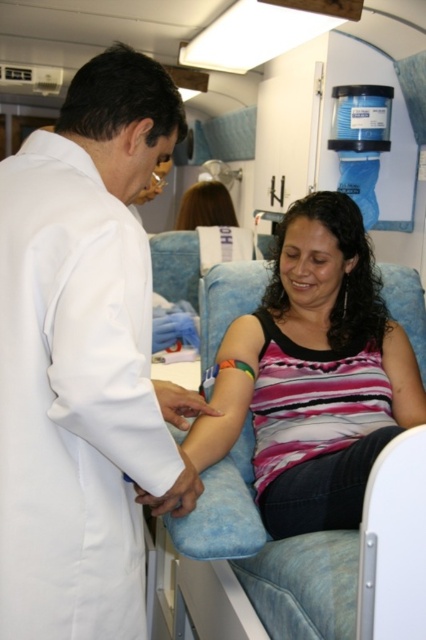
Does pink striped tank top at center lie behind shiny brown hair at upper center?

No.

Between pink striped tank top at center and shiny brown hair at upper center, which one is positioned higher?

Positioned higher is shiny brown hair at upper center.

Between point (305, 216) and point (195, 211), which one is positioned in front?

Point (305, 216) is more forward.

You are a GUI agent. You are given a task and a screenshot of the screen. Output one action in this format:
    pyautogui.click(x=<x>, y=<y>)
    Task: Click on the pink striped tank top at center
    This screenshot has height=640, width=426.
    Given the screenshot: What is the action you would take?
    pyautogui.click(x=313, y=374)

Which is more to the left, white smooth lab coat at left or pink striped tank top at center?

From the viewer's perspective, white smooth lab coat at left appears more on the left side.

Is point (103, 381) farther from camera compared to point (314, 321)?

That is False.

I want to click on white smooth lab coat at left, so click(x=85, y=360).

Is point (141, 154) less distant than point (183, 220)?

Yes, point (141, 154) is in front of point (183, 220).

Can you confirm if white smooth lab coat at left is positioned to the right of shiny brown hair at upper center?

In fact, white smooth lab coat at left is to the left of shiny brown hair at upper center.

Locate an element on the screen. This screenshot has width=426, height=640. white smooth lab coat at left is located at coordinates (85, 360).